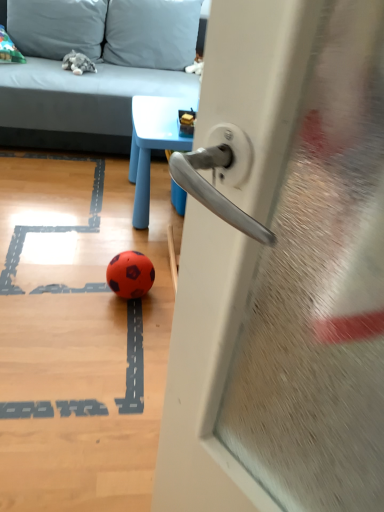
The image size is (384, 512). Find the location of `vacant area in front of rubber soccer ball at center`. vacant area in front of rubber soccer ball at center is located at coordinates (117, 318).